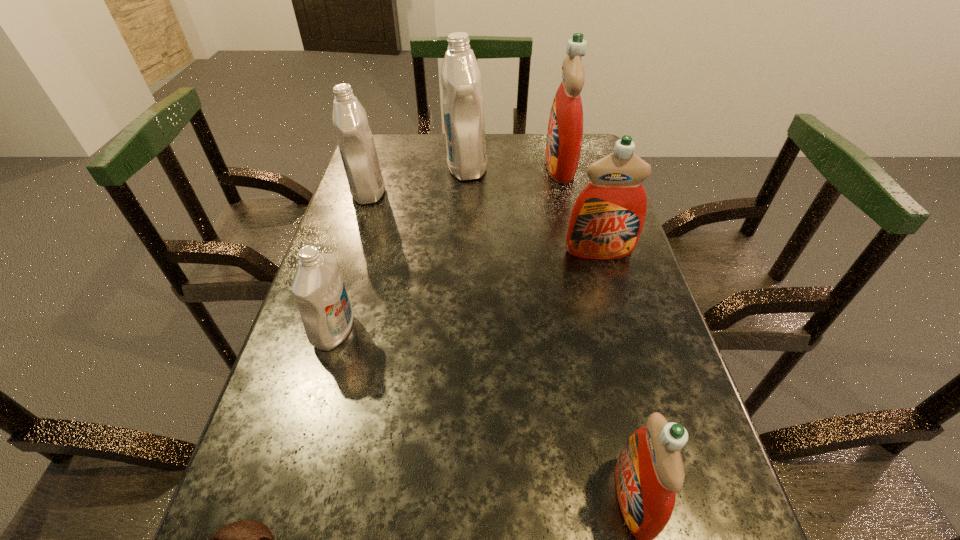
Image resolution: width=960 pixels, height=540 pixels. Identify the location of free spot between the second biggest white detergent and the biggest white detergent. (418, 179).

You are a GUI agent. You are given a task and a screenshot of the screen. Output one action in this format:
    pyautogui.click(x=<x>, y=<y>)
    Task: Click on the free space that is in between the second biggest white detergent and the nearest white detergent
    The image size is (960, 540).
    Given the screenshot: What is the action you would take?
    click(351, 262)

Image resolution: width=960 pixels, height=540 pixels. What are the coordinates of `object that is the fourth closest to the second smallest red detergent` in the screenshot? It's located at (318, 287).

You are a GUI agent. You are given a task and a screenshot of the screen. Output one action in this format:
    pyautogui.click(x=<x>, y=<y>)
    Task: Click on the object that can be found as the sixth closest to the fourth detergent from right to left
    Image resolution: width=960 pixels, height=540 pixels.
    Given the screenshot: What is the action you would take?
    pyautogui.click(x=248, y=539)

The height and width of the screenshot is (540, 960). In order to click on detergent that can be found as the closest to the biggest red detergent in this screenshot , I will do `click(463, 110)`.

At what (x,y) coordinates should I click in order to perform the action: click on the third closest detergent relative to the muffin. Please return your answer as a coordinate pair (x, y). This screenshot has width=960, height=540. Looking at the image, I should click on click(x=606, y=221).

The image size is (960, 540). Find the location of `white detergent that can be found as the second closest to the smallest red detergent`. white detergent that can be found as the second closest to the smallest red detergent is located at coordinates [x=463, y=110].

Where is `white detergent object that ranks as the closest to the rightmost white detergent`? The image size is (960, 540). white detergent object that ranks as the closest to the rightmost white detergent is located at coordinates (350, 121).

This screenshot has width=960, height=540. I want to click on red detergent that can be found as the closest to the rightmost white detergent, so click(565, 129).

Identify which red detergent is the second nearest to the fifth farthest object. Please provide its 2D coordinates. Your answer should be formatted as a tuple, i.e. [(x, y)], where the tuple contains the x and y coordinates of a point satisfying the conditions above.

[(649, 472)]